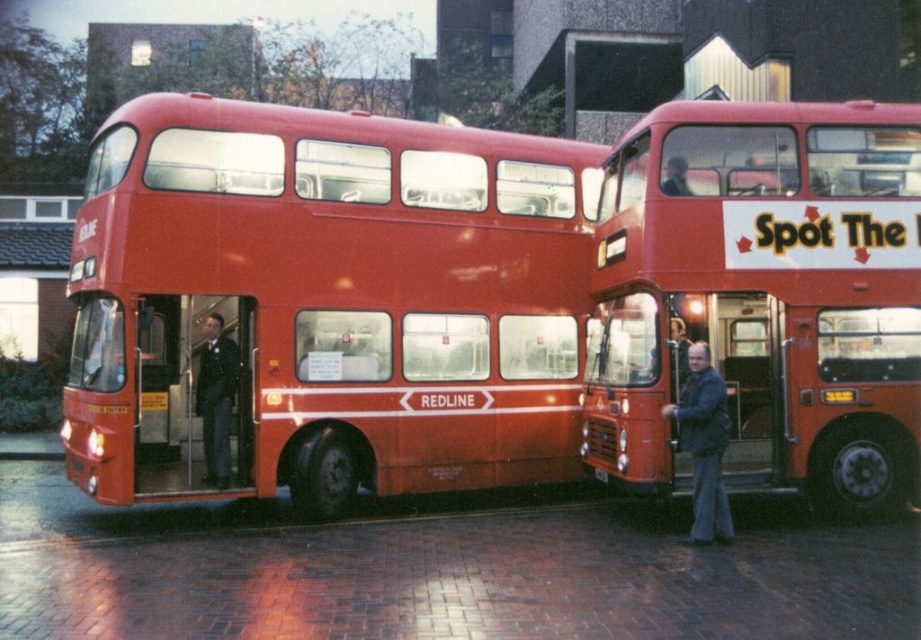
Describe the element at coordinates (327, 301) in the screenshot. This screenshot has width=921, height=640. I see `shiny red bus at center` at that location.

Does point (480, 268) come closer to viewer compared to point (723, 436)?

No, (480, 268) is behind (723, 436).

Where is `shiny red bus at center`? This screenshot has width=921, height=640. shiny red bus at center is located at coordinates (327, 301).

Is matte red bus at center above dark blue jacket at right?

Correct, matte red bus at center is located above dark blue jacket at right.

Is point (906, 497) positioned before point (709, 424)?

No, it is not.

What do you see at coordinates (764, 298) in the screenshot? I see `matte red bus at center` at bounding box center [764, 298].

You are a GUI agent. You are given a task and a screenshot of the screen. Output one action in this format:
    pyautogui.click(x=<x>, y=<y>)
    Task: Click on the matte red bus at center
    The height and width of the screenshot is (640, 921).
    Given the screenshot: What is the action you would take?
    pyautogui.click(x=764, y=298)

Between matte red bus at center and black plastic license plate at center, which one has more height?

Standing taller between the two is matte red bus at center.

Is matte red bus at center shorter than black plastic license plate at center?

No, matte red bus at center is not shorter than black plastic license plate at center.

Is point (657, 204) less distant than point (602, 477)?

Yes, point (657, 204) is closer to viewer.

Image resolution: width=921 pixels, height=640 pixels. Identify the location of matte red bus at center. (764, 298).